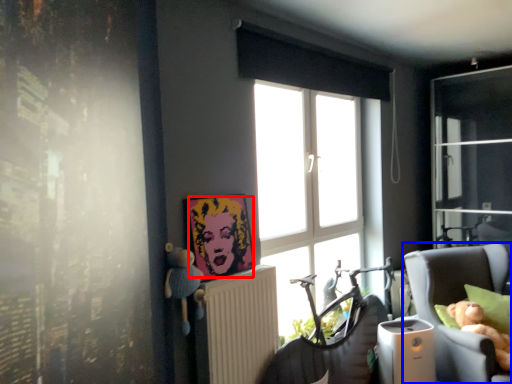
Question: Among these objects, which one is nearest to the camera, person (highlighted by a red box) or chair (highlighted by a blue box)?

Choices:
 (A) person
 (B) chair

Answer: (A)